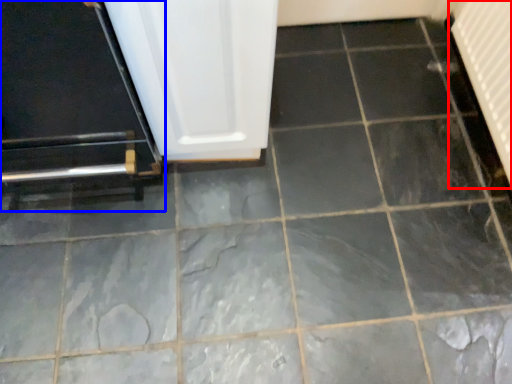
Question: Which of the following is the farthest to the observer, radiator (highlighted by a red box) or door (highlighted by a blue box)?

Choices:
 (A) radiator
 (B) door

Answer: (A)